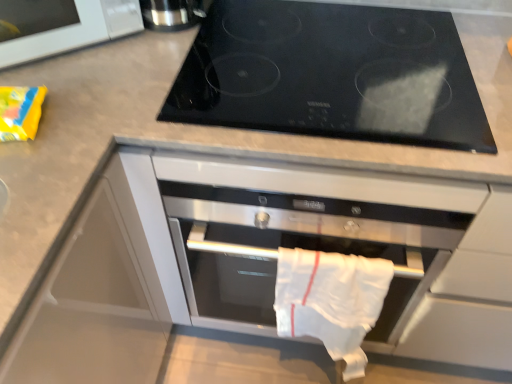
This screenshot has width=512, height=384. I want to click on white cotton towel at center, so click(x=331, y=300).

Is white glossy microwave at upper left facing away from black glass cooktop at upper center?

No, white glossy microwave at upper left's orientation is not away from black glass cooktop at upper center.

Which of these two, white glossy microwave at upper left or black glass cooktop at upper center, stands taller?

white glossy microwave at upper left.

From a real-world perspective, is white glossy microwave at upper left positioned above or below black glass cooktop at upper center?

In terms of real-world spatial position, white glossy microwave at upper left is above black glass cooktop at upper center.

Does black glass cooktop at upper center have a smaller size compared to white cotton towel at center?

Incorrect, black glass cooktop at upper center is not smaller in size than white cotton towel at center.

Can you confirm if black glass cooktop at upper center is shorter than white cotton towel at center?

Correct, black glass cooktop at upper center is not as tall as white cotton towel at center.

Does black glass cooktop at upper center appear on the left side of white cotton towel at center?

Yes, black glass cooktop at upper center is to the left of white cotton towel at center.

Which of these two, white glossy microwave at upper left or satin silver thermos at upper left, is bigger?

With larger size is white glossy microwave at upper left.

Which is behind, point (30, 51) or point (160, 21)?

Positioned behind is point (160, 21).

Do you think white glossy microwave at upper left is within satin silver thermos at upper left, or outside of it?

white glossy microwave at upper left is not enclosed by satin silver thermos at upper left.

From a real-world perspective, is white glossy microwave at upper left physically above satin silver thermos at upper left?

Yes, from a real-world perspective, white glossy microwave at upper left is on top of satin silver thermos at upper left.

Is satin silver thermos at upper left directly adjacent to white cotton towel at center?

They are not placed beside each other.

Is satin silver thermos at upper left thinner than white cotton towel at center?

No.

Which object is further away from the camera taking this photo, satin silver thermos at upper left or white cotton towel at center?

satin silver thermos at upper left is further from the camera.

Locate an element on the screen. The image size is (512, 384). appliance above the white cotton towel at center (from a real-world perspective) is located at coordinates (173, 14).

Would you say black glass cooktop at upper center is outside satin silver thermos at upper left?

Yes, black glass cooktop at upper center is located beyond the bounds of satin silver thermos at upper left.

From a real-world perspective, is black glass cooktop at upper center under satin silver thermos at upper left?

Yes, from a real-world perspective, black glass cooktop at upper center is beneath satin silver thermos at upper left.

From the image's perspective, does black glass cooktop at upper center appear lower than satin silver thermos at upper left?

Indeed, from the image's perspective, black glass cooktop at upper center is shown beneath satin silver thermos at upper left.

Based on their positions, is black glass cooktop at upper center located to the left or right of satin silver thermos at upper left?

In the image, black glass cooktop at upper center appears on the right side of satin silver thermos at upper left.

From a real-world perspective, is white cotton towel at center physically located above or below satin silver thermos at upper left?

white cotton towel at center is below satin silver thermos at upper left.

Who is taller, white cotton towel at center or satin silver thermos at upper left?

With more height is white cotton towel at center.

How many degrees apart are the facing directions of white cotton towel at center and satin silver thermos at upper left?

There is a 32.2-degree angle between the facing directions of white cotton towel at center and satin silver thermos at upper left.

Can you confirm if white cotton towel at center is thinner than satin silver thermos at upper left?

Yes.

Are white glossy microwave at upper left and white cotton towel at center beside each other?

No, white glossy microwave at upper left is not touching white cotton towel at center.

You are a GUI agent. You are given a task and a screenshot of the screen. Output one action in this format:
    pyautogui.click(x=<x>, y=<y>)
    Task: Click on the microwave lying above the white cotton towel at center (from the image's perspective)
    
    Given the screenshot: What is the action you would take?
    pyautogui.click(x=75, y=31)

Is white cotton towel at center inside white glossy microwave at upper left?

No.

In the image, is white glossy microwave at upper left positioned in front of or behind white cotton towel at center?

white glossy microwave at upper left is in front of white cotton towel at center.

Where is `microwave to the left of black glass cooktop at upper center`? This screenshot has width=512, height=384. microwave to the left of black glass cooktop at upper center is located at coordinates (75, 31).

This screenshot has height=384, width=512. I want to click on gas stove that appears above the white cotton towel at center (from the image's perspective), so [332, 74].

Based on their spatial positions, is white cotton towel at center or black glass cooktop at upper center further from white glossy microwave at upper left?

white cotton towel at center is positioned further to the anchor white glossy microwave at upper left.

When comparing their distances from satin silver thermos at upper left, does white glossy microwave at upper left or white cotton towel at center seem further?

Among the two, white cotton towel at center is located further to satin silver thermos at upper left.

Considering their positions, is white glossy microwave at upper left positioned closer to black glass cooktop at upper center than white cotton towel at center?

white glossy microwave at upper left lies closer to black glass cooktop at upper center than the other object.

Based on their spatial positions, is white glossy microwave at upper left or black glass cooktop at upper center closer to satin silver thermos at upper left?

Among the two, white glossy microwave at upper left is located nearer to satin silver thermos at upper left.

Estimate the real-world distances between objects in this image. Which object is further from black glass cooktop at upper center, white glossy microwave at upper left or satin silver thermos at upper left?

white glossy microwave at upper left is positioned further to the anchor black glass cooktop at upper center.

Estimate the real-world distances between objects in this image. Which object is further from satin silver thermos at upper left, black glass cooktop at upper center or white cotton towel at center?

Among the two, white cotton towel at center is located further to satin silver thermos at upper left.

When comparing their distances from black glass cooktop at upper center, does satin silver thermos at upper left or white cotton towel at center seem closer?

The object closer to black glass cooktop at upper center is satin silver thermos at upper left.

When comparing their distances from white cotton towel at center, does black glass cooktop at upper center or white glossy microwave at upper left seem closer?

The object closer to white cotton towel at center is black glass cooktop at upper center.

At what (x,y) coordinates should I click in order to perform the action: click on gas stove between satin silver thermos at upper left and white cotton towel at center from top to bottom. Please return your answer as a coordinate pair (x, y). Looking at the image, I should click on (332, 74).

Where is `microwave between satin silver thermos at upper left and white cotton towel at center in the up-down direction`? The height and width of the screenshot is (384, 512). microwave between satin silver thermos at upper left and white cotton towel at center in the up-down direction is located at coordinates (75, 31).

The width and height of the screenshot is (512, 384). Identify the location of gas stove between white glossy microwave at upper left and white cotton towel at center in the up-down direction. (332, 74).

Find the location of a particular element. This screenshot has width=512, height=384. appliance located between white glossy microwave at upper left and black glass cooktop at upper center in the left-right direction is located at coordinates (173, 14).